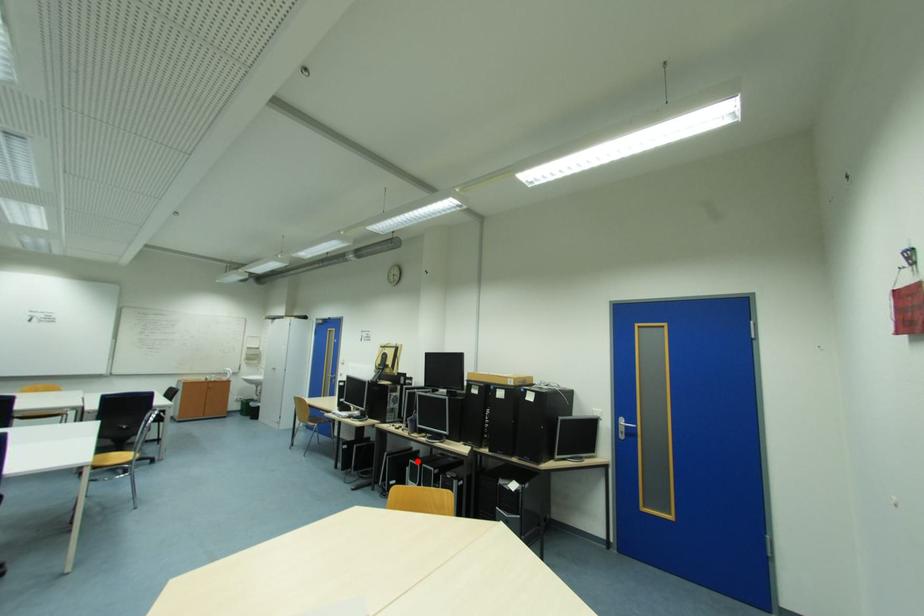
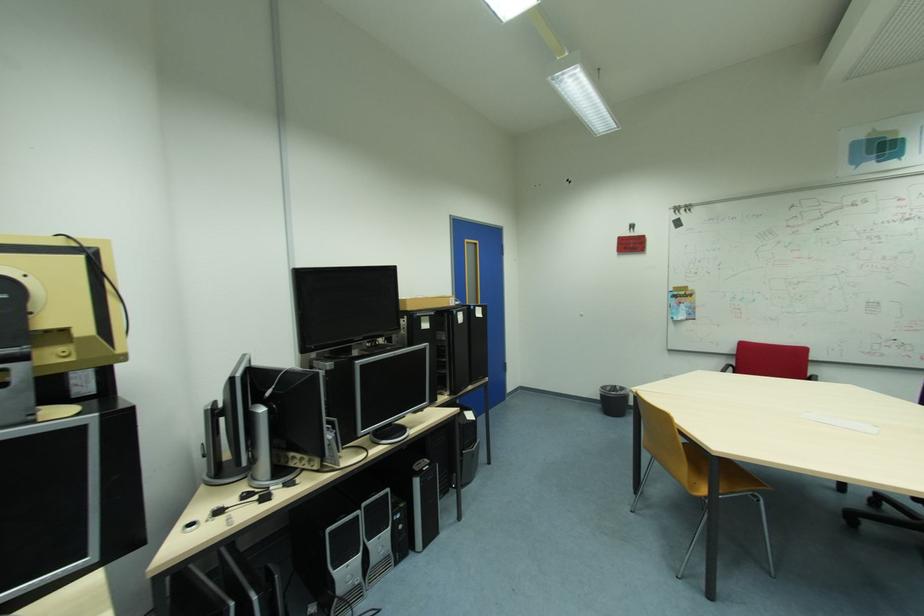
Question: I am providing you with two images of the same scene from different viewpoints. In image1, a red point is highlighted. Considering the same 3D point in image2, which of the following is correct?

Choices:
 (A) It is closer
 (B) It is farther

Answer: (A)